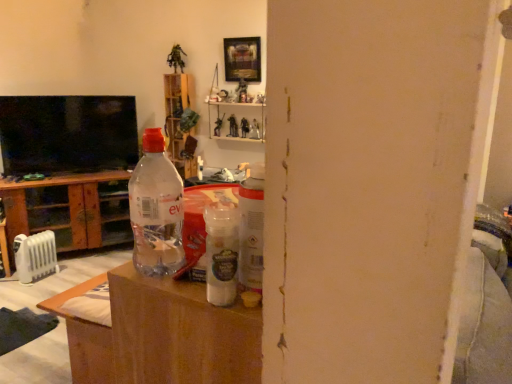
Question: From the image's perspective, is transparent plastic cabinet at left located above black glossy tv at upper left?

Choices:
 (A) yes
 (B) no

Answer: (B)

Question: From a real-world perspective, is transparent plastic cabinet at left on black glossy tv at upper left?

Choices:
 (A) yes
 (B) no

Answer: (B)

Question: Can you confirm if transparent plastic cabinet at left is shorter than black glossy tv at upper left?

Choices:
 (A) no
 (B) yes

Answer: (A)

Question: Does transparent plastic cabinet at left have a larger size compared to black glossy tv at upper left?

Choices:
 (A) no
 (B) yes

Answer: (B)

Question: From a real-world perspective, is transparent plastic cabinet at left located beneath black glossy tv at upper left?

Choices:
 (A) no
 (B) yes

Answer: (B)

Question: Can you confirm if transparent plastic cabinet at left is wider than black glossy tv at upper left?

Choices:
 (A) no
 (B) yes

Answer: (B)

Question: From the image's perspective, is wooden picture frame at upper center beneath transparent plastic bottle at center?

Choices:
 (A) yes
 (B) no

Answer: (B)

Question: Is wooden picture frame at upper center located outside transparent plastic bottle at center?

Choices:
 (A) yes
 (B) no

Answer: (A)

Question: Does wooden picture frame at upper center contain transparent plastic bottle at center?

Choices:
 (A) no
 (B) yes

Answer: (A)

Question: From a real-world perspective, is wooden picture frame at upper center physically below transparent plastic bottle at center?

Choices:
 (A) no
 (B) yes

Answer: (A)

Question: Can you confirm if wooden picture frame at upper center is smaller than transparent plastic bottle at center?

Choices:
 (A) yes
 (B) no

Answer: (B)

Question: Is wooden picture frame at upper center further to the viewer compared to transparent plastic bottle at center?

Choices:
 (A) no
 (B) yes

Answer: (B)

Question: Can you confirm if wooden picture frame at upper center is positioned to the left of wooden shelf at upper center?

Choices:
 (A) no
 (B) yes

Answer: (A)